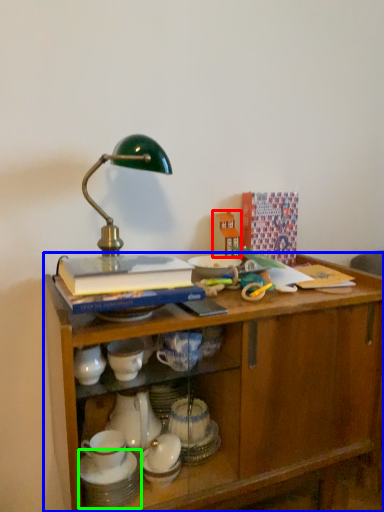
Question: Based on their relative distances, which object is farther from toy (highlighted by a red box)? Choose from desk (highlighted by a blue box) and tableware (highlighted by a green box).

Choices:
 (A) desk
 (B) tableware

Answer: (B)